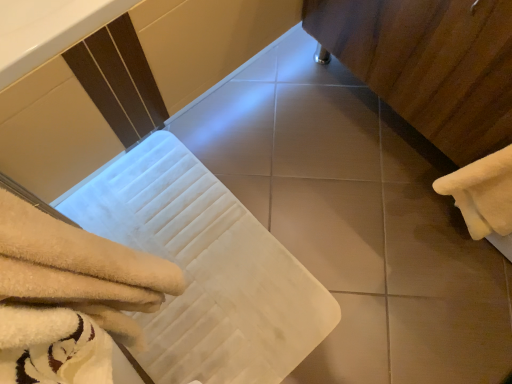
Image resolution: width=512 pixels, height=384 pixels. What are the coordinates of `smooth beige tile at center` in the screenshot? It's located at (332, 230).

Describe the element at coordinates (332, 230) in the screenshot. I see `smooth beige tile at center` at that location.

This screenshot has height=384, width=512. Describe the element at coordinates (79, 270) in the screenshot. I see `white fluffy towel at lower left, arranged as the second towel when viewed from the right` at that location.

Locate an element on the screen. white soft towel at lower left is located at coordinates (206, 270).

In order to face white soft towel at lower left, should I rotate leftwards or rightwards?

You should rotate left by 9.683 degrees.

You are a GUI agent. You are given a task and a screenshot of the screen. Output one action in this format:
    pyautogui.click(x=<x>, y=<y>)
    Task: Click on the smooth beige tile at center
    The width and height of the screenshot is (512, 384).
    Given the screenshot: What is the action you would take?
    coord(332,230)

Is smooth beige tile at center situated inside white fluffy towel at right, which ranks as the first towel in right-to-left order, or outside?

smooth beige tile at center is spatially situated outside white fluffy towel at right, which ranks as the first towel in right-to-left order.

From the image's perspective, would you say smooth beige tile at center is positioned over white fluffy towel at right, which ranks as the first towel in right-to-left order?

Incorrect, from the image's perspective, smooth beige tile at center is lower than white fluffy towel at right, which ranks as the first towel in right-to-left order.

Is smooth beige tile at center thinner than white fluffy towel at right, the 2th towel positioned from the left?

In fact, smooth beige tile at center might be wider than white fluffy towel at right, the 2th towel positioned from the left.

Between point (329, 218) and point (499, 221), which one is positioned in front?

The point (499, 221) is more forward.

From a real-world perspective, is smooth beige tile at center on top of wooden cabinet at right?

No.

Considering the positions of objects smooth beige tile at center and wooden cabinet at right in the image provided, who is more to the right, smooth beige tile at center or wooden cabinet at right?

wooden cabinet at right.

Which is in front, smooth beige tile at center or wooden cabinet at right?

Positioned in front is wooden cabinet at right.

From the image's perspective, which is below, smooth beige tile at center or wooden cabinet at right?

smooth beige tile at center appears lower in the image.

Is white fluffy towel at right, the 2th towel positioned from the left, closer to camera compared to wooden cabinet at right?

No, white fluffy towel at right, the 2th towel positioned from the left, is further to the viewer.

From the image's perspective, is white fluffy towel at right, which ranks as the first towel in right-to-left order, positioned above or below wooden cabinet at right?

Clearly, from the image's perspective, white fluffy towel at right, which ranks as the first towel in right-to-left order, is below wooden cabinet at right.

Considering the sizes of objects white fluffy towel at right, which ranks as the first towel in right-to-left order, and wooden cabinet at right in the image provided, who is wider, white fluffy towel at right, which ranks as the first towel in right-to-left order, or wooden cabinet at right?

wooden cabinet at right.

Would you say white fluffy towel at right, which ranks as the first towel in right-to-left order, is outside wooden cabinet at right?

Yes, white fluffy towel at right, which ranks as the first towel in right-to-left order, is outside of wooden cabinet at right.

Is white fluffy towel at lower left, arranged as the second towel when viewed from the right, oriented towards wooden cabinet at right?

Yes, white fluffy towel at lower left, arranged as the second towel when viewed from the right, is aimed at wooden cabinet at right.

Is the position of white fluffy towel at lower left, arranged as the second towel when viewed from the right, less distant than that of wooden cabinet at right?

Yes, white fluffy towel at lower left, arranged as the second towel when viewed from the right, is closer to the camera.

Image resolution: width=512 pixels, height=384 pixels. Find the location of `towel in front of the wooden cabinet at right`. towel in front of the wooden cabinet at right is located at coordinates (79, 270).

Is white fluffy towel at lower left, arranged as the second towel when viewed from the right, bigger than wooden cabinet at right?

No, white fluffy towel at lower left, arranged as the second towel when viewed from the right, is not bigger than wooden cabinet at right.

From the image's perspective, is wooden cabinet at right beneath white fluffy towel at right, which ranks as the first towel in right-to-left order?

No.

Which object is positioned more to the right, wooden cabinet at right or white fluffy towel at right, which ranks as the first towel in right-to-left order?

Positioned to the right is white fluffy towel at right, which ranks as the first towel in right-to-left order.

Is point (409, 102) closer or farther from the camera than point (483, 231)?

Point (409, 102) appears to be farther away from the viewer than point (483, 231).

Between white fluffy towel at right, which ranks as the first towel in right-to-left order, and white soft towel at lower left, which one has larger width?

Wider between the two is white soft towel at lower left.

Can you tell me how much white fluffy towel at right, the 2th towel positioned from the left, and white soft towel at lower left differ in facing direction?

They differ by 91.5 degrees in their facing directions.

Is white fluffy towel at right, which ranks as the first towel in right-to-left order, to the left or to the right of white soft towel at lower left in the image?

From the image, it's evident that white fluffy towel at right, which ranks as the first towel in right-to-left order, is to the right of white soft towel at lower left.

Which is correct: white fluffy towel at right, which ranks as the first towel in right-to-left order, is inside white soft towel at lower left, or outside of it?

white fluffy towel at right, which ranks as the first towel in right-to-left order, is spatially situated outside white soft towel at lower left.

Between white soft towel at lower left and white fluffy towel at lower left, arranged as the first towel when viewed from the left, which one has more height?

With more height is white fluffy towel at lower left, arranged as the first towel when viewed from the left.

Does white soft towel at lower left have a greater width compared to white fluffy towel at lower left, arranged as the first towel when viewed from the left?

Indeed, white soft towel at lower left has a greater width compared to white fluffy towel at lower left, arranged as the first towel when viewed from the left.

What's the angular difference between white soft towel at lower left and white fluffy towel at lower left, arranged as the second towel when viewed from the right,'s facing directions?

The facing directions of white soft towel at lower left and white fluffy towel at lower left, arranged as the second towel when viewed from the right, are 92.1 degrees apart.

Identify the location of tile lying on the left of white fluffy towel at right, which ranks as the first towel in right-to-left order. (332, 230).

Where is `tile directly beneath the wooden cabinet at right (from a real-world perspective)`? The width and height of the screenshot is (512, 384). tile directly beneath the wooden cabinet at right (from a real-world perspective) is located at coordinates (332, 230).

Looking at the image, which one is located further to smooth beige tile at center, white soft towel at lower left or wooden cabinet at right?

wooden cabinet at right is further to smooth beige tile at center.

Based on the photo, which object lies nearer to the anchor point white fluffy towel at right, which ranks as the first towel in right-to-left order, wooden cabinet at right or smooth beige tile at center?

The object closer to white fluffy towel at right, which ranks as the first towel in right-to-left order, is wooden cabinet at right.

Based on their spatial positions, is white fluffy towel at right, the 2th towel positioned from the left, or white soft towel at lower left further from smooth beige tile at center?

Based on the image, white fluffy towel at right, the 2th towel positioned from the left, appears to be further to smooth beige tile at center.

Considering their positions, is smooth beige tile at center positioned closer to white soft towel at lower left than white fluffy towel at lower left, arranged as the first towel when viewed from the left?

smooth beige tile at center is positioned closer to the anchor white soft towel at lower left.

From the picture: Based on their spatial positions, is white soft towel at lower left or wooden cabinet at right closer to white fluffy towel at lower left, arranged as the first towel when viewed from the left?

Based on the image, white soft towel at lower left appears to be nearer to white fluffy towel at lower left, arranged as the first towel when viewed from the left.

Considering their positions, is white fluffy towel at lower left, arranged as the first towel when viewed from the left, positioned closer to white fluffy towel at right, the 2th towel positioned from the left, than smooth beige tile at center?

smooth beige tile at center.

When comparing their distances from white fluffy towel at right, the 2th towel positioned from the left, does white soft towel at lower left or smooth beige tile at center seem further?

white soft towel at lower left.

When comparing their distances from smooth beige tile at center, does white fluffy towel at lower left, arranged as the second towel when viewed from the right, or white soft towel at lower left seem closer?

white soft towel at lower left is closer to smooth beige tile at center.

Find the location of `tile between white soft towel at lower left and wooden cabinet at right in the horizontal direction`. tile between white soft towel at lower left and wooden cabinet at right in the horizontal direction is located at coordinates (332, 230).

In order to click on cabinetry between white soft towel at lower left and white fluffy towel at right, the 2th towel positioned from the left, from left to right in this screenshot , I will do `click(429, 64)`.

You are a GUI agent. You are given a task and a screenshot of the screen. Output one action in this format:
    pyautogui.click(x=<x>, y=<y>)
    Task: Click on the towel between white fluffy towel at lower left, arranged as the second towel when viewed from the right, and white soft towel at lower left in the front-back direction
    The height and width of the screenshot is (384, 512).
    Given the screenshot: What is the action you would take?
    click(482, 193)

The image size is (512, 384). What are the coordinates of `cabinetry positioned between white fluffy towel at lower left, arranged as the first towel when viewed from the left, and smooth beige tile at center from near to far` in the screenshot? It's located at (429, 64).